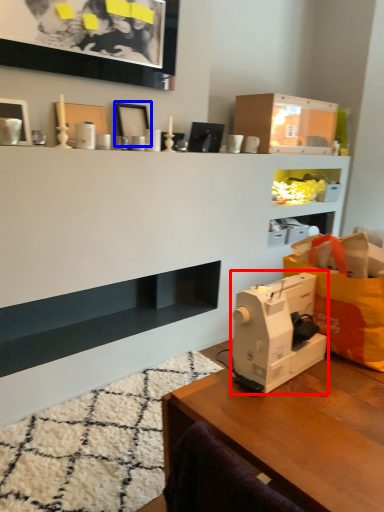
Question: Among these objects, which one is farthest to the camera, sewing machine (highlighted by a red box) or picture frame (highlighted by a blue box)?

Choices:
 (A) sewing machine
 (B) picture frame

Answer: (B)